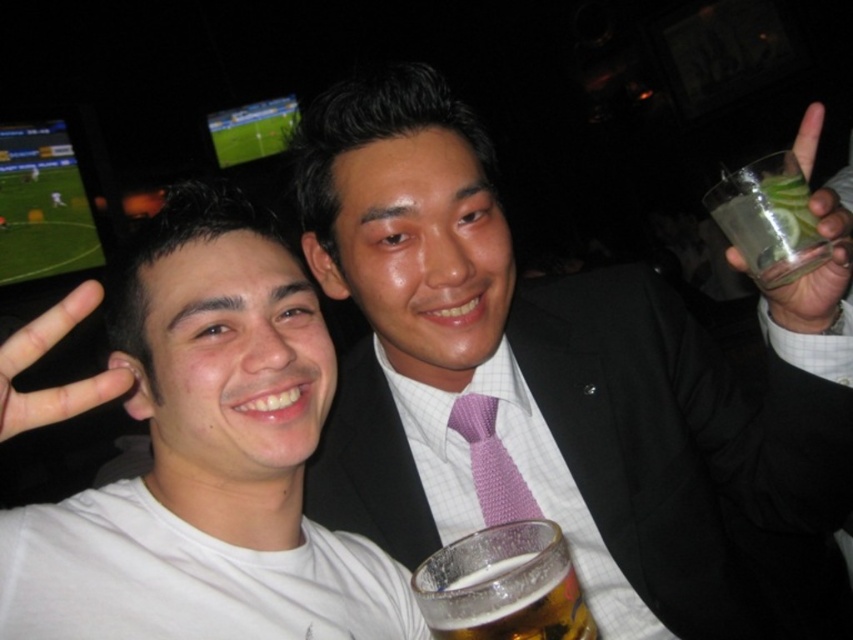
Question: Which object is positioned closest to the clear glass at upper right?

Choices:
 (A) purple knitted tie at center
 (B) white matte hand at left
 (C) purple textured tie at center
 (D) white matte t-shirt at left

Answer: (C)

Question: Among these points, which one is farthest from the camera?

Choices:
 (A) (436, 566)
 (B) (550, 371)

Answer: (B)

Question: Does white matte hand at left appear under clear glass at upper right?

Choices:
 (A) yes
 (B) no

Answer: (A)

Question: Which of the following is the farthest from the observer?

Choices:
 (A) (848, 264)
 (B) (462, 422)
 (C) (822, 337)

Answer: (B)

Question: Is translucent glass beer at center wider than white matte hand at left?

Choices:
 (A) yes
 (B) no

Answer: (B)

Question: Does white matte t-shirt at left appear on the right side of white matte hand at left?

Choices:
 (A) no
 (B) yes

Answer: (B)